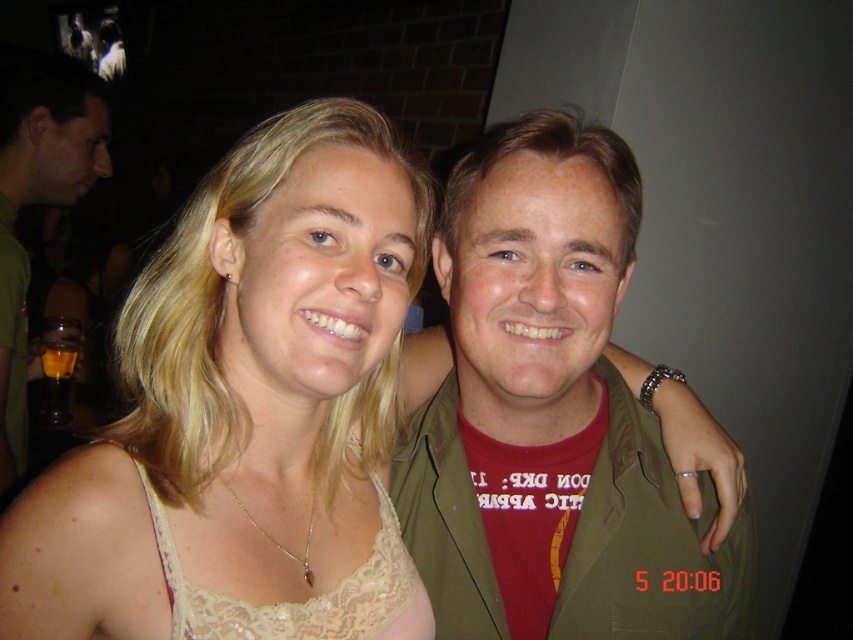
Question: Where is green matte jacket at center located in relation to green matte shirt at left in the image?

Choices:
 (A) below
 (B) above

Answer: (A)

Question: Which of the following is the farthest from the observer?

Choices:
 (A) (531, 259)
 (B) (64, 150)

Answer: (B)

Question: Is lace beige top at center below green matte shirt at left?

Choices:
 (A) no
 (B) yes

Answer: (B)

Question: Is lace beige top at center positioned at the back of green matte shirt at left?

Choices:
 (A) no
 (B) yes

Answer: (A)

Question: Among these points, which one is nearest to the camera?

Choices:
 (A) (352, 420)
 (B) (22, 307)
 (C) (596, 208)

Answer: (C)

Question: Considering the real-world distances, which object is farthest from the green matte jacket at center?

Choices:
 (A) green matte shirt at left
 (B) lace beige top at center

Answer: (A)